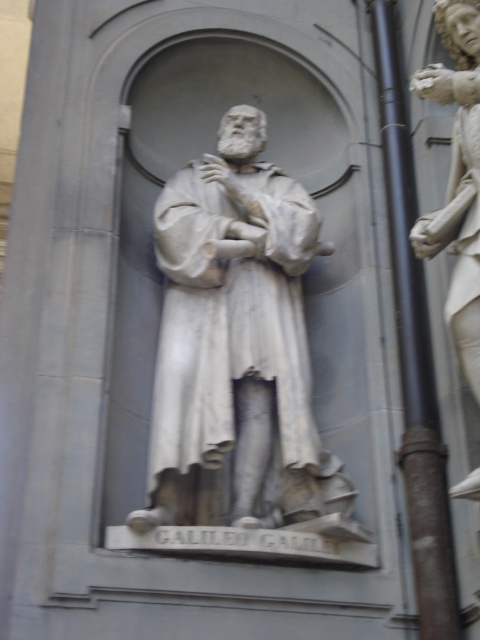
Question: Does white marble statue at center have a larger size compared to white marble statue at right?

Choices:
 (A) no
 (B) yes

Answer: (B)

Question: Which point is closer to the camera taking this photo?

Choices:
 (A) (470, 288)
 (B) (307, 355)

Answer: (A)

Question: Can you confirm if white marble statue at center is positioned above black metal pole at right?

Choices:
 (A) no
 (B) yes

Answer: (A)

Question: Does white marble statue at center have a lesser width compared to black metal pole at right?

Choices:
 (A) no
 (B) yes

Answer: (A)

Question: Based on their relative distances, which object is farther from the white marble statue at right?

Choices:
 (A) black metal pole at right
 (B) white marble statue at center

Answer: (B)

Question: Which of these objects is positioned closest to the black metal pole at right?

Choices:
 (A) white marble statue at center
 (B) white marble statue at right

Answer: (B)